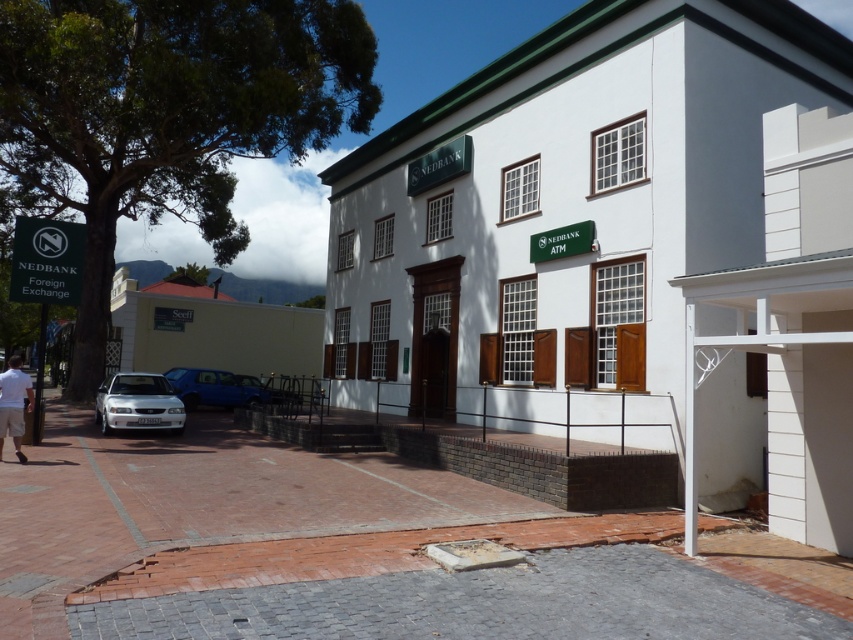
You are a customer arriving at the Nedbank branch and see the white matte sedan at lower left and the light brown shorts at lower left. Which object is bigger?

The white matte sedan at lower left is larger in size than the light brown shorts at lower left.

You are a delivery person trying to park your 1.8 meters tall delivery box next to the light brown shorts at lower left. Can the metallic blue van at center park in the same spot without blocking the delivery box?

The metallic blue van at center is taller than the light brown shorts at lower left. Since the delivery box is 1.8 meters tall, if the van is taller than the shorts but the delivery box is placed next to the shorts, the van might block the delivery box depending on their exact positions. However, based on the given information, we can only confirm the height difference, not the horizontal space. Therefore, it is uncertain if the van will block the delivery box without more details on their positioning.